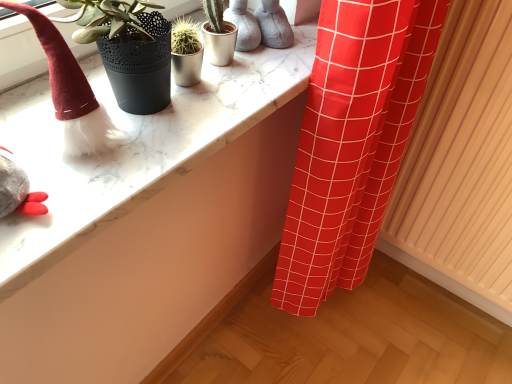
Question: From a real-world perspective, does wooden radiator at right sit lower than marble counter top at upper left?

Choices:
 (A) yes
 (B) no

Answer: (A)

Question: Can we say wooden radiator at right lies outside marble counter top at upper left?

Choices:
 (A) no
 (B) yes

Answer: (B)

Question: Does wooden radiator at right appear on the right side of marble counter top at upper left?

Choices:
 (A) yes
 (B) no

Answer: (A)

Question: Considering the relative sizes of wooden radiator at right and marble counter top at upper left in the image provided, is wooden radiator at right bigger than marble counter top at upper left?

Choices:
 (A) yes
 (B) no

Answer: (A)

Question: Can you confirm if wooden radiator at right is shorter than marble counter top at upper left?

Choices:
 (A) no
 (B) yes

Answer: (A)

Question: Looking at the image, does fuzzy red hat at left seem bigger or smaller compared to wooden radiator at right?

Choices:
 (A) big
 (B) small

Answer: (B)

Question: From the image's perspective, relative to wooden radiator at right, is fuzzy red hat at left above or below?

Choices:
 (A) above
 (B) below

Answer: (A)

Question: In terms of height, does fuzzy red hat at left look taller or shorter compared to wooden radiator at right?

Choices:
 (A) tall
 (B) short

Answer: (B)

Question: Is point (47, 33) closer or farther from the camera than point (480, 231)?

Choices:
 (A) farther
 (B) closer

Answer: (B)

Question: Is marble counter top at upper left spatially inside wooden radiator at right, or outside of it?

Choices:
 (A) outside
 (B) inside

Answer: (A)

Question: In the image, is marble counter top at upper left on the left side or the right side of wooden radiator at right?

Choices:
 (A) left
 (B) right

Answer: (A)

Question: Relative to wooden radiator at right, is marble counter top at upper left in front or behind?

Choices:
 (A) front
 (B) behind

Answer: (A)

Question: In terms of height, does marble counter top at upper left look taller or shorter compared to wooden radiator at right?

Choices:
 (A) short
 (B) tall

Answer: (A)

Question: Considering the positions of fuzzy red hat at left and marble counter top at upper left in the image, is fuzzy red hat at left wider or thinner than marble counter top at upper left?

Choices:
 (A) wide
 (B) thin

Answer: (B)

Question: From a real-world perspective, is fuzzy red hat at left above or below marble counter top at upper left?

Choices:
 (A) below
 (B) above

Answer: (B)